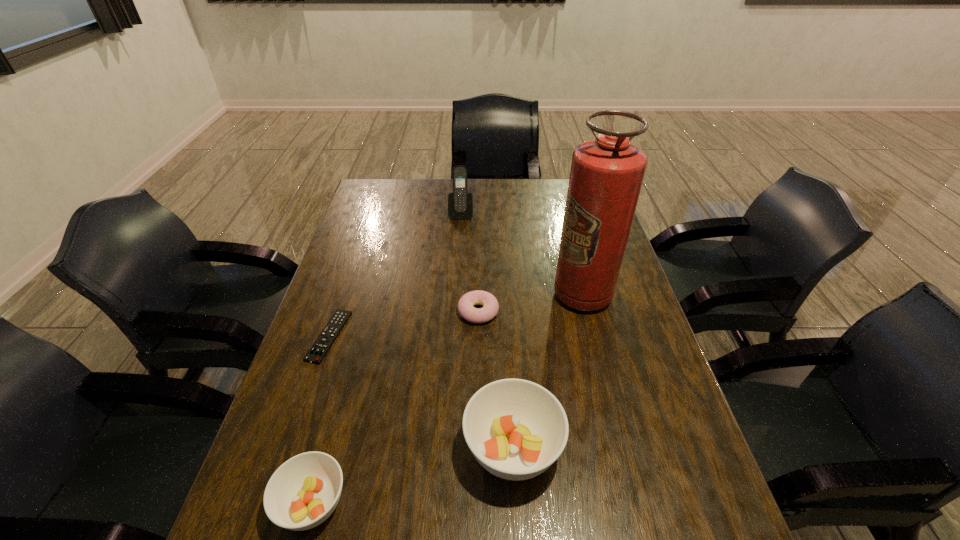
In the image, there is a desktop. What are the coordinates of `vacant space at the left edge` in the screenshot? It's located at (382, 246).

Image resolution: width=960 pixels, height=540 pixels. What are the coordinates of `vacant area at the right edge` in the screenshot? It's located at (621, 402).

At what (x,y) coordinates should I click in order to perform the action: click on vacant point located between the cellular telephone and the shortest object. Please return your answer as a coordinate pair (x, y). The width and height of the screenshot is (960, 540). Looking at the image, I should click on (396, 275).

The width and height of the screenshot is (960, 540). What are the coordinates of `empty location between the doughnut and the rightmost object` in the screenshot? It's located at (530, 303).

Where is `free space between the fifth shortest object and the tallest object`? This screenshot has width=960, height=540. free space between the fifth shortest object and the tallest object is located at coordinates (521, 254).

This screenshot has height=540, width=960. I want to click on object that is the second closest one to the shorter soup bowl, so point(317,352).

The height and width of the screenshot is (540, 960). Identify the location of object that stands as the fifth closest to the remote control. (606, 176).

Locate an element on the screen. The width and height of the screenshot is (960, 540). free location that satisfies the following two spatial constraints: 1. on the front-facing side of the second shortest object; 2. on the left side of the fifth shortest object is located at coordinates (455, 312).

I want to click on vacant region that satisfies the following two spatial constraints: 1. on the front-facing side of the third tallest object; 2. on the right side of the cellular telephone, so click(447, 448).